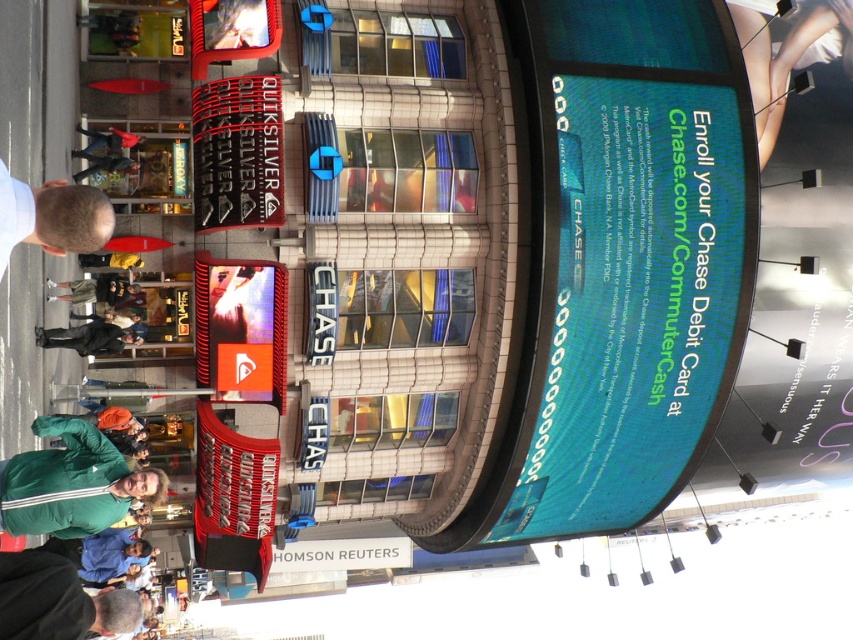
Is point (115, 332) positioned after point (115, 134)?

No, (115, 332) is in front of (115, 134).

Identify the location of dark gray jacket at lower left. (90, 337).

Is point (68, 342) more distant than point (90, 138)?

No, it is not.

At what (x,y) coordinates should I click in order to perform the action: click on dark gray jacket at lower left. Please return your answer as a coordinate pair (x, y). This screenshot has width=853, height=640. Looking at the image, I should click on (90, 337).

Which is below, black matte sign at upper left or dark gray jacket at lower left?

dark gray jacket at lower left is lower down.

Which of these two, black matte sign at upper left or dark gray jacket at lower left, stands taller?

With more height is black matte sign at upper left.

What do you see at coordinates (236, 152) in the screenshot? I see `black matte sign at upper left` at bounding box center [236, 152].

Where is `black matte sign at upper left`? This screenshot has height=640, width=853. black matte sign at upper left is located at coordinates (236, 152).

From the picture: Which is more to the right, green track jacket at lower left or green jacket at lower left?

Positioned to the right is green jacket at lower left.

Who is lower down, green track jacket at lower left or green jacket at lower left?

Positioned lower is green track jacket at lower left.

Is point (161, 483) less distant than point (97, 292)?

Yes.

Locate an element on the screen. The image size is (853, 640). green track jacket at lower left is located at coordinates (70, 483).